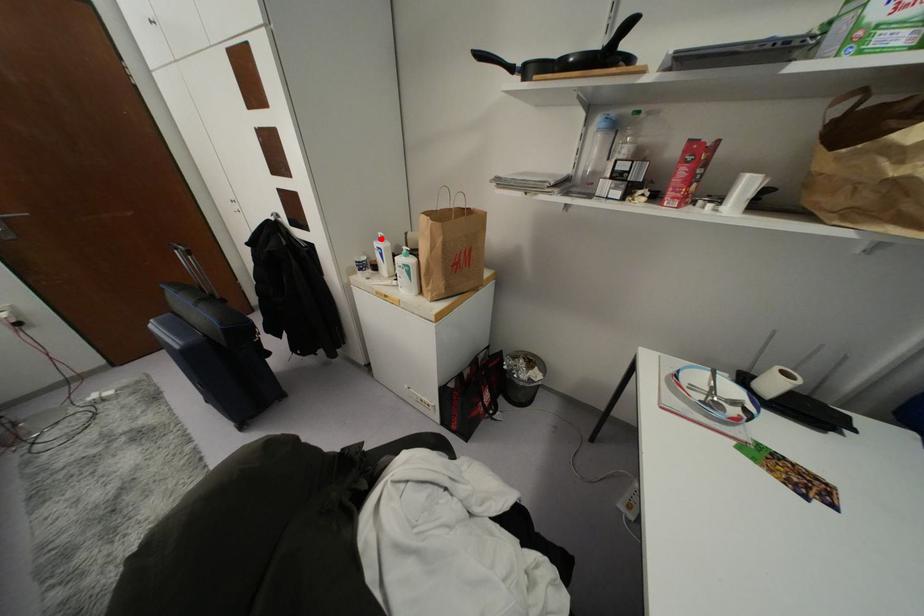
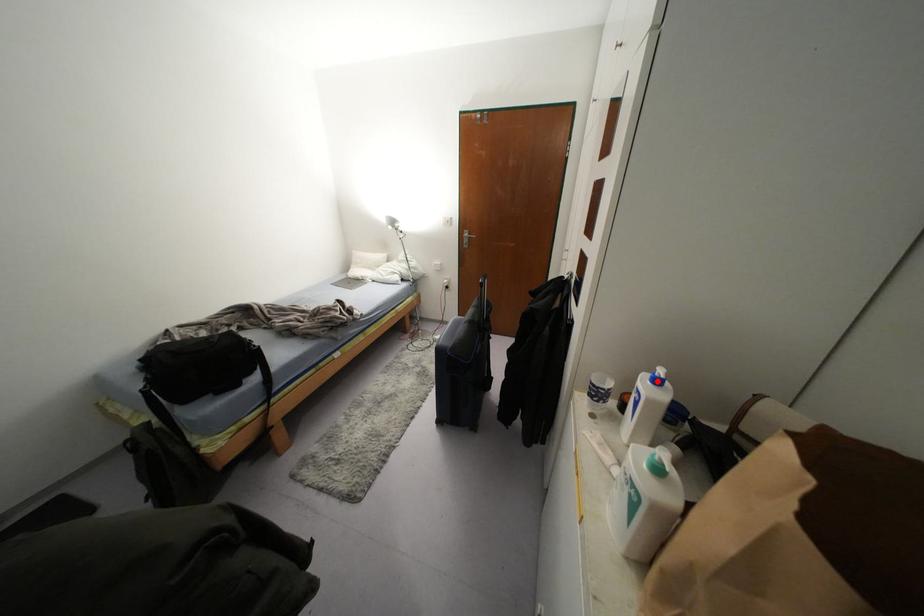
I am providing you with two images of the same scene from different viewpoints. A red point is marked on the first image and another point is marked on the second image. Does the point marked in image1 correspond to the same location as the one in image2?

Yes